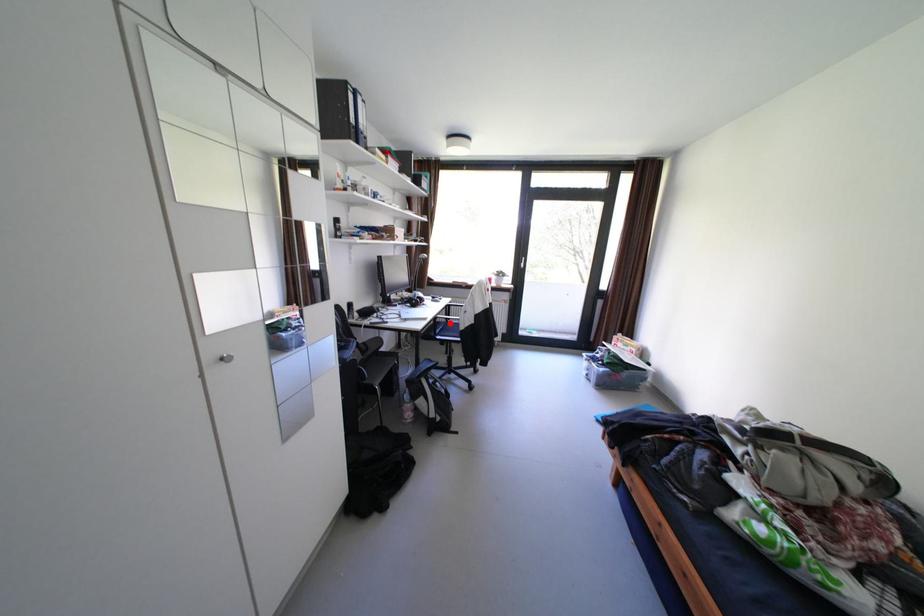
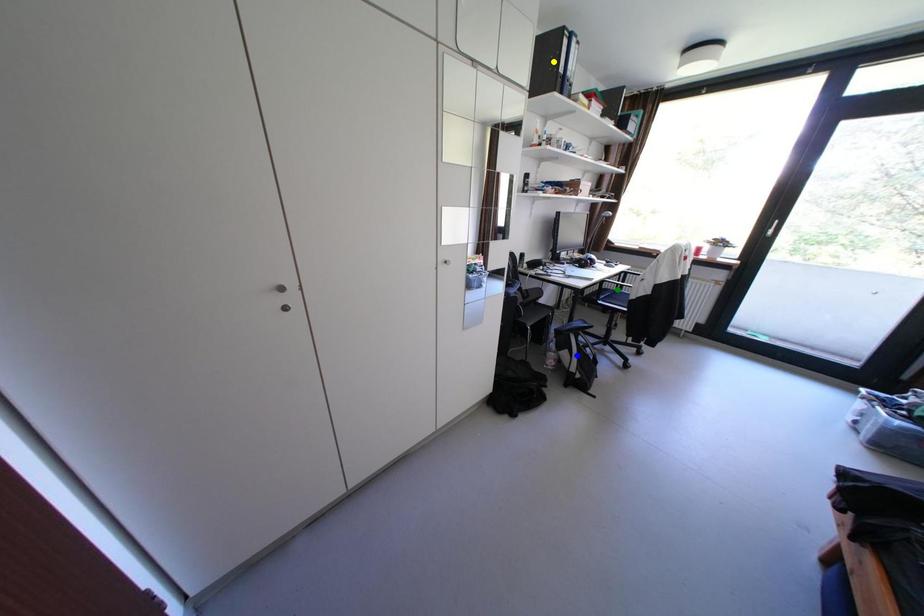
Question: I am providing you with two images of the same scene from different viewpoints. A red point is marked on the first image. You are given multiple points on the second image. Which spot in image 2 lines up with the point in image 1?

Choices:
 (A) green point
 (B) blue point
 (C) yellow point

Answer: (A)